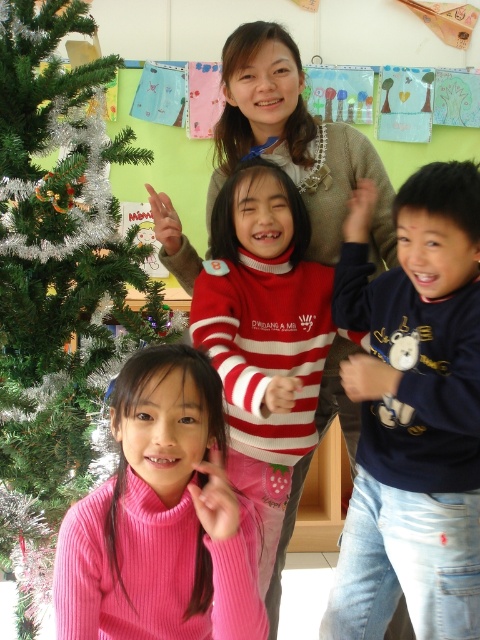
Question: Considering the real-world distances, which object is closest to the dark blue cotton shirt at right?

Choices:
 (A) green tinsel christmas tree at left
 (B) pink ribbed sweater at center

Answer: (B)

Question: Is dark blue cotton shirt at right wider than green tinsel christmas tree at left?

Choices:
 (A) no
 (B) yes

Answer: (A)

Question: Can you confirm if dark blue cotton shirt at right is bigger than pink ribbed sweater at center?

Choices:
 (A) yes
 (B) no

Answer: (A)

Question: Which of the following is the farthest from the observer?

Choices:
 (A) green tinsel christmas tree at left
 (B) dark blue cotton shirt at right

Answer: (A)

Question: Which point is farther to the camera?

Choices:
 (A) (187, 403)
 (B) (456, 433)
 (C) (56, 422)

Answer: (C)

Question: Considering the relative positions of dark blue cotton shirt at right and green tinsel christmas tree at left in the image provided, where is dark blue cotton shirt at right located with respect to green tinsel christmas tree at left?

Choices:
 (A) right
 (B) left

Answer: (A)